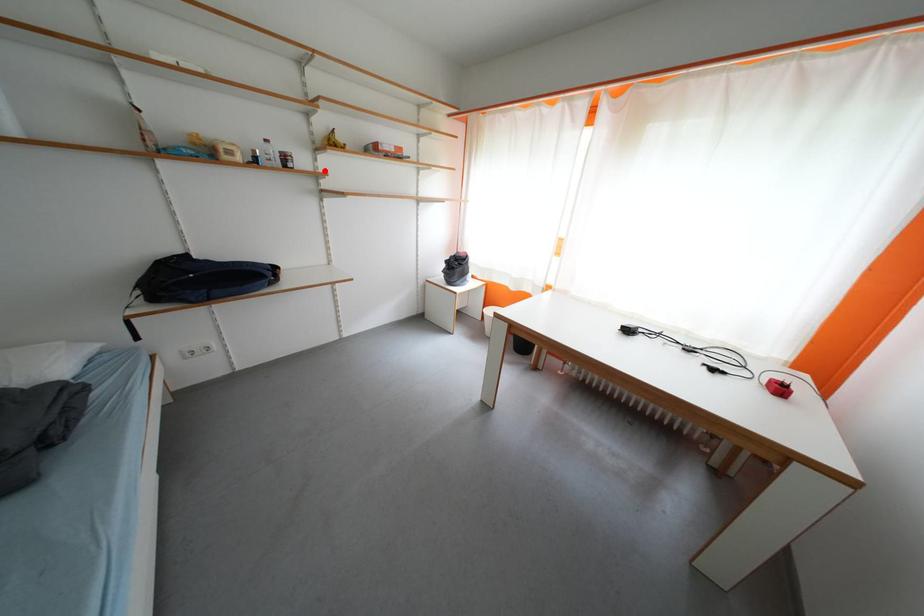
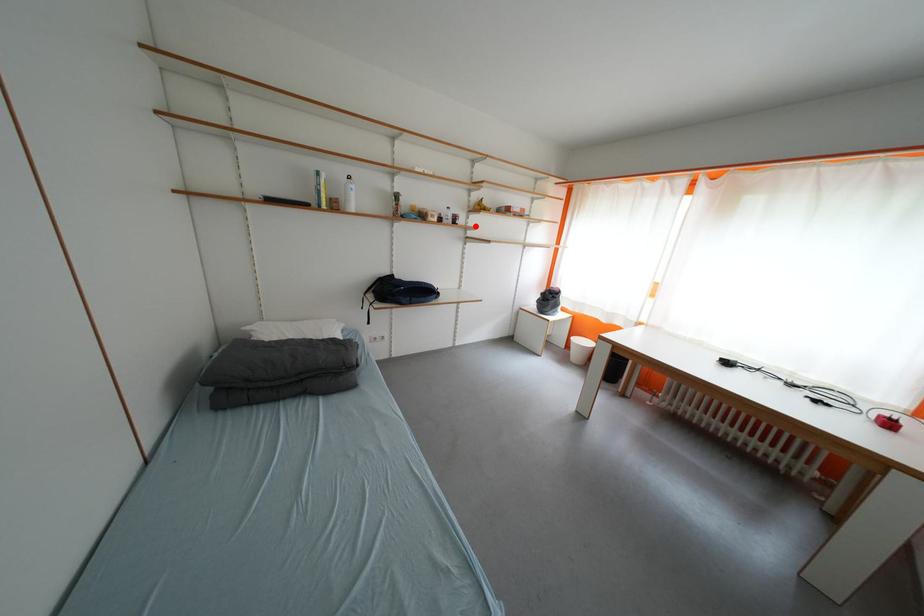
I am providing you with two images of the same scene from different viewpoints. A red point is marked on the first image and another point is marked on the second image. Is the marked point in image1 the same physical position as the marked point in image2?

Yes